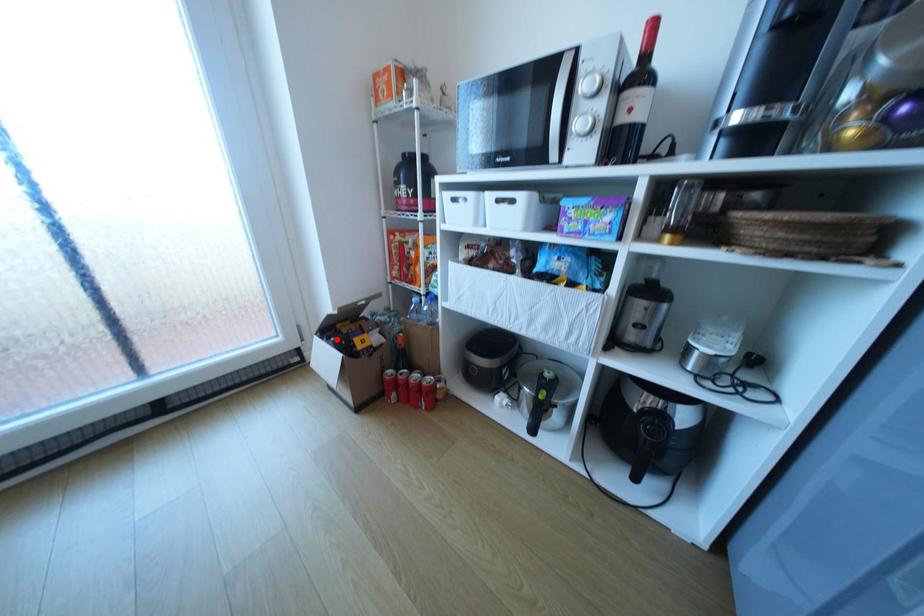
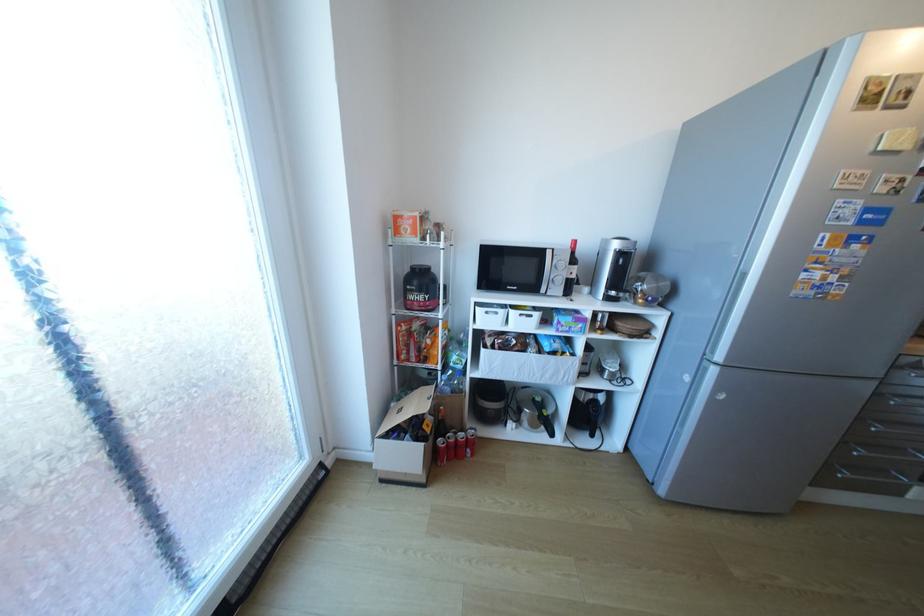
Where in the second image is the point corresponding to the highlighted location from the first image?

(407, 437)